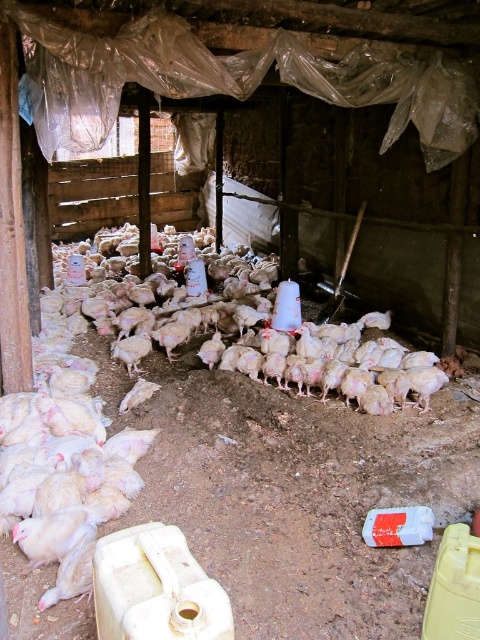
Is white feathered chicken at center positioned at the back of white matte chicken at center?

No, it is not.

At what (x,y) coordinates should I click in order to perform the action: click on white feathered chicken at center. Please return your answer as a coordinate pair (x, y). This screenshot has height=640, width=480. Looking at the image, I should click on (183, 426).

This screenshot has width=480, height=640. What are the coordinates of `white feathered chicken at center` in the screenshot? It's located at (183, 426).